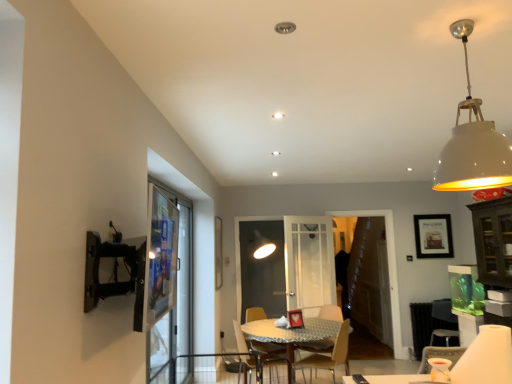
Question: From a real-world perspective, is wooden table at center above or below transparent glass screen door at center, positioned as the 2th screen door in left-to-right order?

Choices:
 (A) below
 (B) above

Answer: (A)

Question: In the image, is wooden table at center positioned in front of or behind transparent glass screen door at center, which ranks as the 1th screen door in back-to-front order?

Choices:
 (A) front
 (B) behind

Answer: (A)

Question: Based on their relative distances, which object is farther from the wooden table at center?

Choices:
 (A) wooden chair at center, which is the second chair from left to right
 (B) matte black picture frame at upper right
 (C) white matte lampshade at upper right
 (D) wooden chair at center, acting as the second chair starting from the right
 (E) transparent glass screen door at center, placed as the third screen door when sorted from left to right

Answer: (C)

Question: Based on their relative distances, which object is farther from the white matte lampshade at upper right?

Choices:
 (A) wooden table at center
 (B) transparent glass screen door at center, marked as the 3th screen door in a front-to-back arrangement
 (C) transparent glass screen door at left, which is the first screen door from left to right
 (D) wooden chair at center, acting as the first chair starting from the left
 (E) matte black picture frame at upper right

Answer: (B)